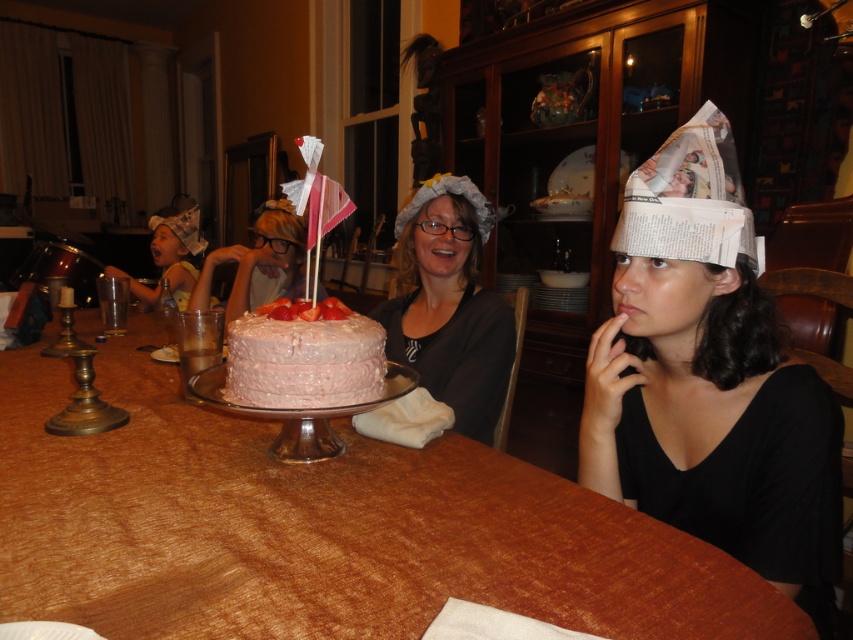
Question: Among these objects, which one is nearest to the camera?

Choices:
 (A) white newspaper hat at center
 (B) matte gray fabric hat at center
 (C) pink frosted cake at center
 (D) wooden table at center

Answer: (D)

Question: From the image, what is the correct spatial relationship of white newspaper hat at center in relation to matte gray fabric hat at center?

Choices:
 (A) below
 (B) above

Answer: (A)

Question: Which object is closer to the camera taking this photo?

Choices:
 (A) pink frosted cake at center
 (B) wooden table at center
 (C) matte gray fabric hat at center
 (D) white newspaper hat at center

Answer: (B)

Question: Does wooden table at center have a smaller size compared to white newspaper hat at center?

Choices:
 (A) no
 (B) yes

Answer: (A)

Question: Is wooden table at center to the left of white newspaper hat at center from the viewer's perspective?

Choices:
 (A) no
 (B) yes

Answer: (B)

Question: Estimate the real-world distances between objects in this image. Which object is farther from the white newspaper hat at center?

Choices:
 (A) wooden table at center
 (B) matte gray fabric hat at center

Answer: (B)